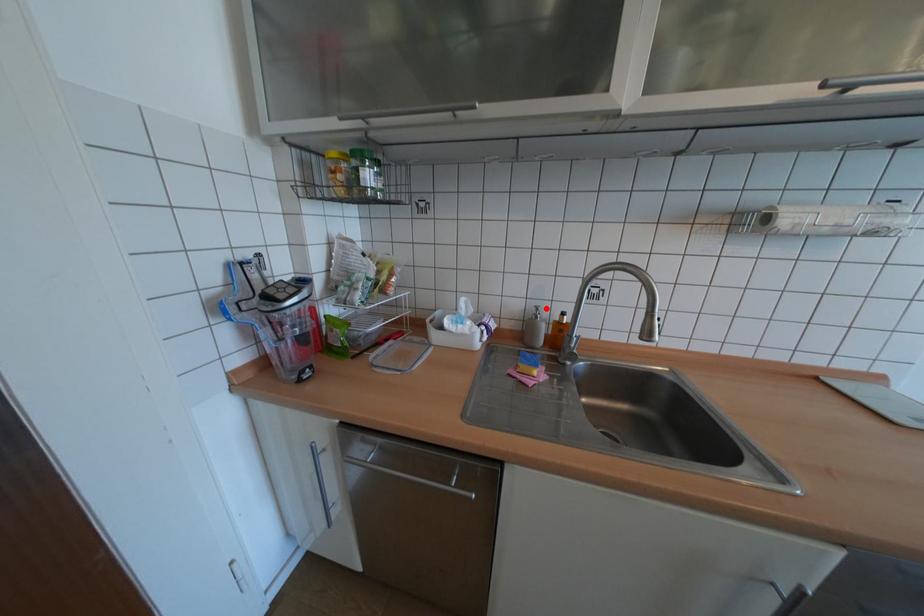
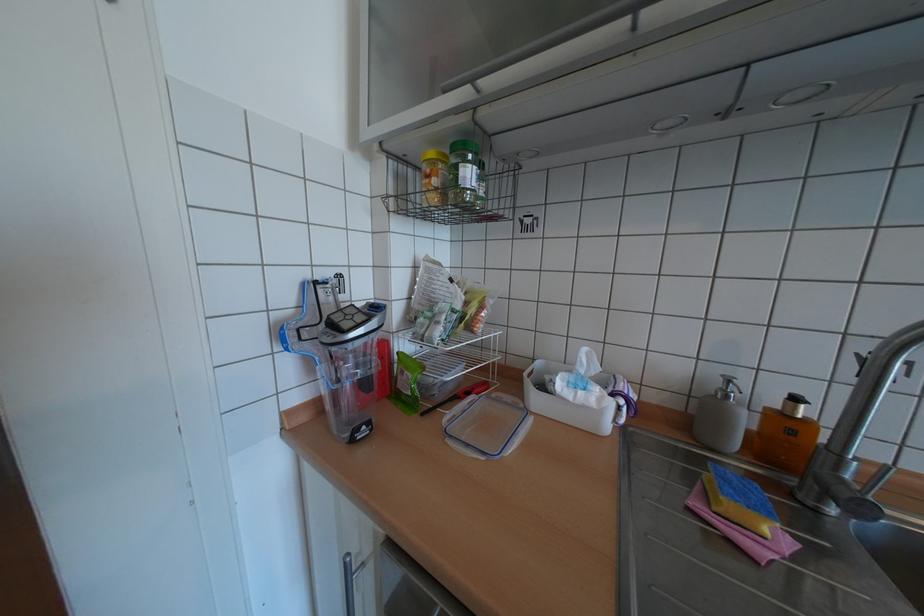
Find the pixel in the second image that matches the highlighted location in the first image.

(737, 381)